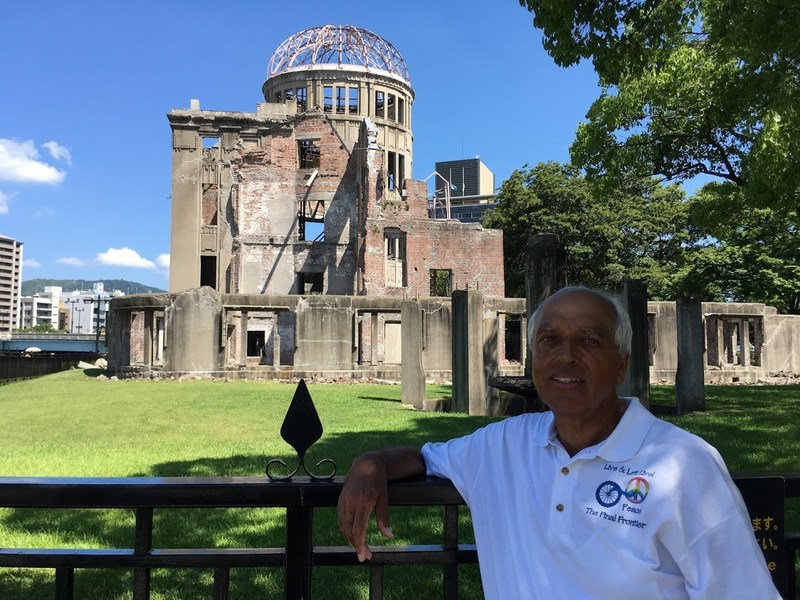
The width and height of the screenshot is (800, 600). I want to click on windows, so click(x=313, y=150), click(x=390, y=165), click(x=382, y=91), click(x=346, y=92), click(x=301, y=265), click(x=248, y=326), click(x=382, y=250).